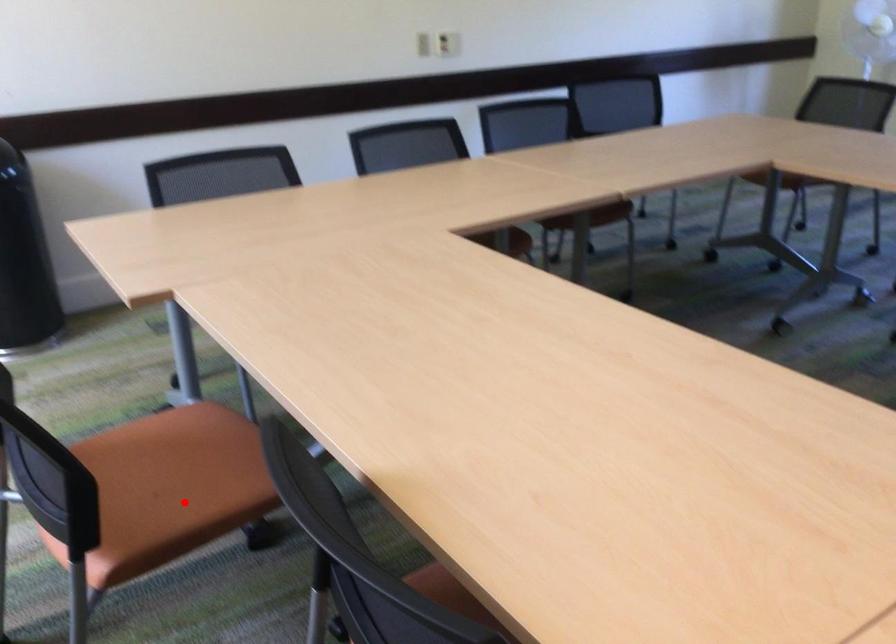
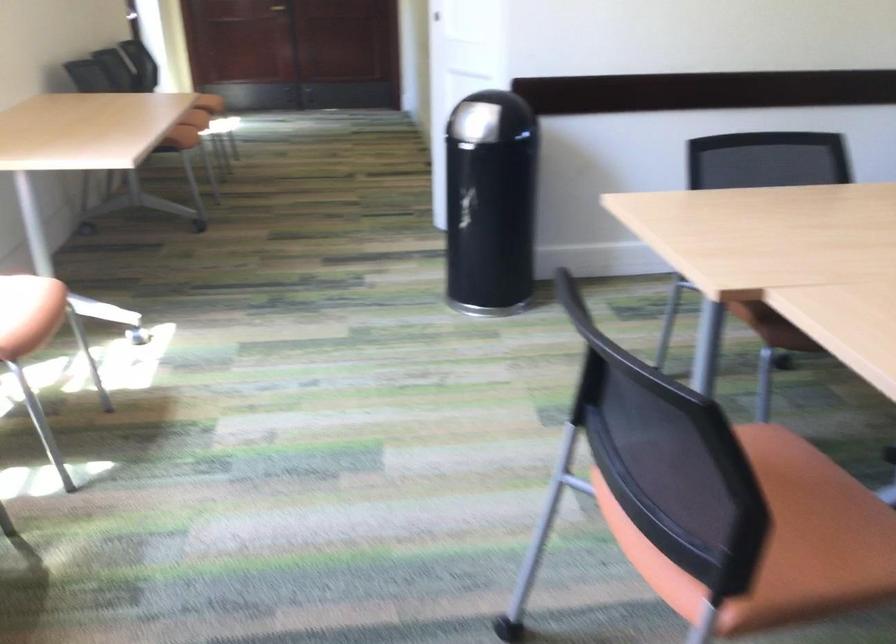
Question: I am providing you with two images of the same scene from different viewpoints. Given a red point in image1, look at the same physical point in image2. Is it:

Choices:
 (A) Closer to the viewpoint
 (B) Farther from the viewpoint

Answer: (A)